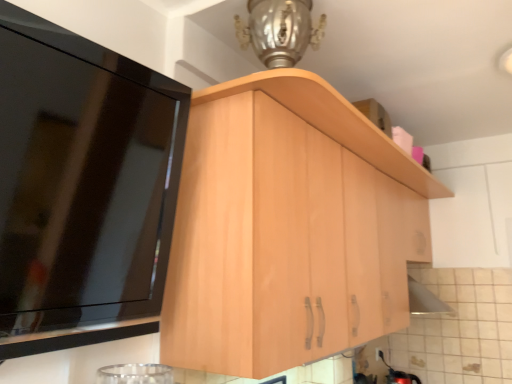
Question: From a real-world perspective, does light wood cabinet at upper left, the second cabinetry when ordered from back to front, sit lower than light wood cabinet at center, acting as the first cabinetry starting from the right?

Choices:
 (A) no
 (B) yes

Answer: (A)

Question: Can you confirm if light wood cabinet at upper left, the second cabinetry when ordered from back to front, is wider than light wood cabinet at center, the second cabinetry in the left-to-right sequence?

Choices:
 (A) yes
 (B) no

Answer: (B)

Question: Does light wood cabinet at upper left, the second cabinetry when ordered from back to front, appear on the right side of light wood cabinet at center, acting as the first cabinetry starting from the right?

Choices:
 (A) yes
 (B) no

Answer: (B)

Question: Is light wood cabinet at upper left, which is counted as the first cabinetry, starting from the left, to the left of light wood cabinet at center, acting as the first cabinetry starting from the right, from the viewer's perspective?

Choices:
 (A) no
 (B) yes

Answer: (B)

Question: From the image's perspective, is light wood cabinet at upper left, which is the second cabinetry from right to left, beneath light wood cabinet at center, acting as the first cabinetry starting from the right?

Choices:
 (A) yes
 (B) no

Answer: (B)

Question: Considering the relative sizes of light wood cabinet at upper left, which is the second cabinetry from right to left, and light wood cabinet at center, acting as the first cabinetry starting from the right, in the image provided, is light wood cabinet at upper left, which is the second cabinetry from right to left, taller than light wood cabinet at center, acting as the first cabinetry starting from the right,?

Choices:
 (A) yes
 (B) no

Answer: (B)

Question: Are light wood cabinet at center, which is the 2th cabinetry in front-to-back order, and light wood cabinet at upper left, positioned as the first cabinetry in front-to-back order, located far from each other?

Choices:
 (A) no
 (B) yes

Answer: (A)

Question: Is light wood cabinet at center, which is the 2th cabinetry in front-to-back order, positioned with its back to light wood cabinet at upper left, which is counted as the first cabinetry, starting from the left?

Choices:
 (A) yes
 (B) no

Answer: (B)

Question: Does light wood cabinet at center, the second cabinetry in the left-to-right sequence, appear on the left side of light wood cabinet at upper left, which is the second cabinetry from right to left?

Choices:
 (A) yes
 (B) no

Answer: (B)

Question: From a real-world perspective, is light wood cabinet at center, the 1th cabinetry viewed from the back, physically above light wood cabinet at upper left, which is counted as the first cabinetry, starting from the left?

Choices:
 (A) yes
 (B) no

Answer: (B)

Question: From the image's perspective, would you say light wood cabinet at center, the 1th cabinetry viewed from the back, is positioned over light wood cabinet at upper left, the second cabinetry when ordered from back to front?

Choices:
 (A) yes
 (B) no

Answer: (B)

Question: Does light wood cabinet at center, the 1th cabinetry viewed from the back, touch light wood cabinet at upper left, which is the second cabinetry from right to left?

Choices:
 (A) yes
 (B) no

Answer: (B)

Question: In the image, is light wood cabinet at center, the second cabinetry in the left-to-right sequence, positioned in front of or behind light wood cabinet at upper left, positioned as the first cabinetry in front-to-back order?

Choices:
 (A) front
 (B) behind

Answer: (B)